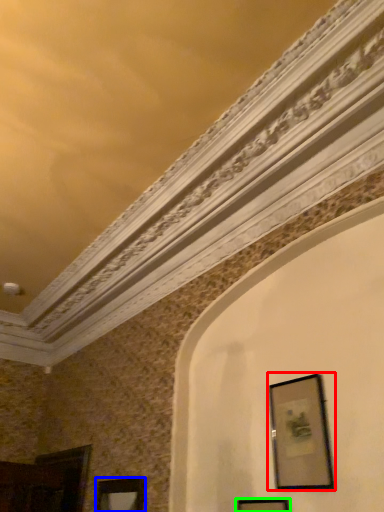
Question: Estimate the real-world distances between objects in this image. Which object is closer to picture frame (highlighted by a red box), picture frame (highlighted by a blue box) or picture frame (highlighted by a green box)?

Choices:
 (A) picture frame
 (B) picture frame

Answer: (B)